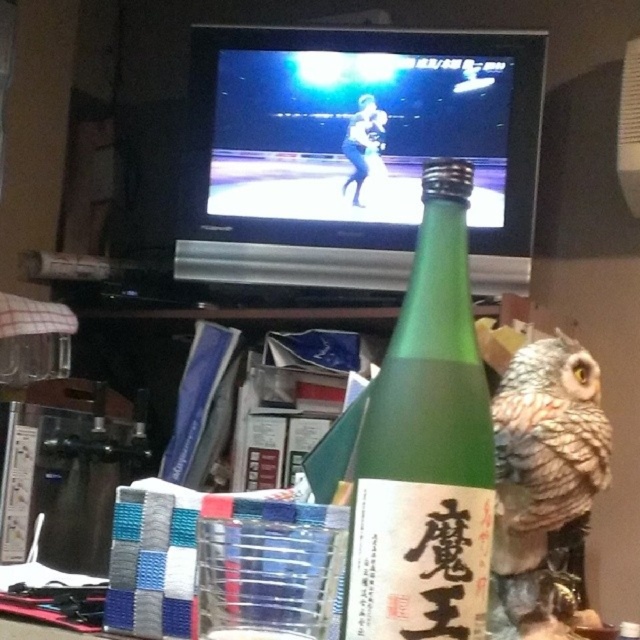
You are organizing a shelf and need to place the green glass bottle at center and the brown speckled owl at right. If the shelf has a height limit of 15 cm, can both items fit without exceeding the limit?

The green glass bottle at center is taller than the brown speckled owl at right, but since the exact height of the bottle isn

You are standing in the cluttered indoor setting and want to place a small item on the table between the two points labeled point (x=461, y=211) and point (x=577, y=346). Which point should you place it closer to if you want it to be closer to the green bottle with a white label featuring Japanese characters?

You should place the item closer to point (x=461, y=211) because it is in front of point (x=577, y=346), making it nearer to the green bottle with a white label featuring Japanese characters.

You are standing in a room with a green glass bottle at center and a small owl figurine to its right. Where is the point located at coordinates (426, 449) in relation to these objects?

The point at coordinates (426, 449) indicates the green glass bottle at center.